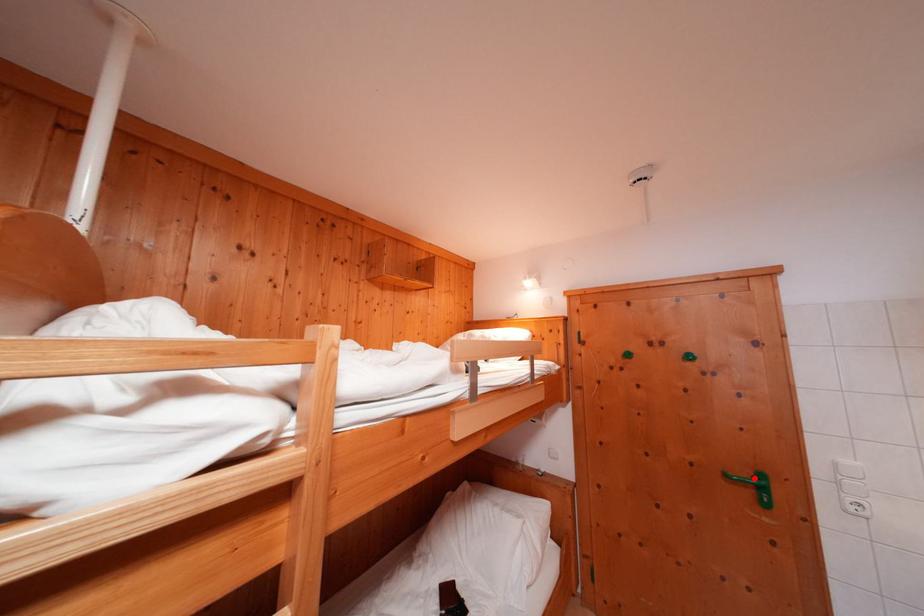
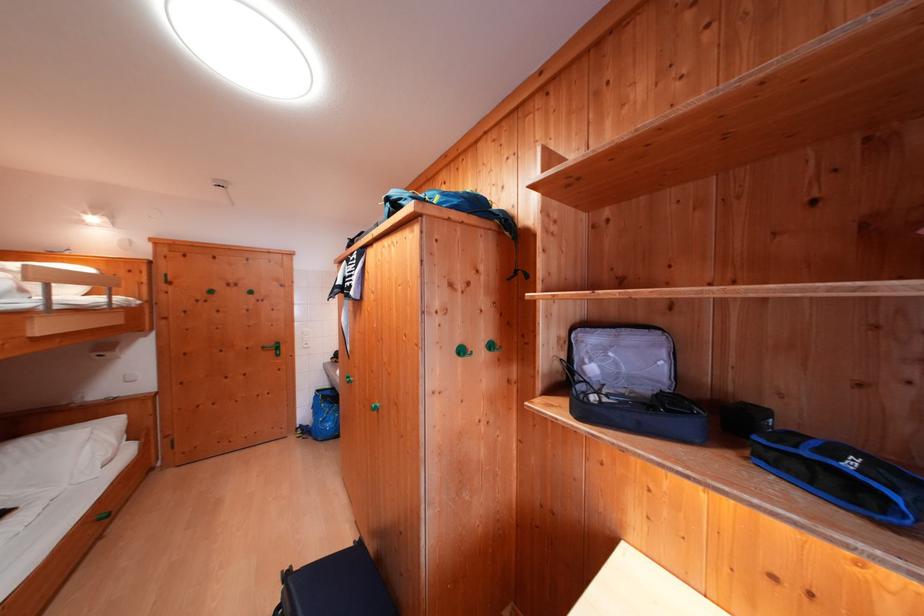
Question: I am providing you with two images of the same scene from different viewpoints. A red point is marked on the first image. At the location where the point appears in image 1, is it still visible in image 2?

Choices:
 (A) Yes
 (B) No

Answer: (A)